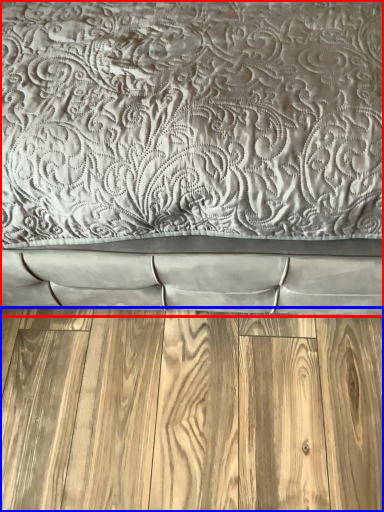
Question: Which of the following is the closest to the observer, bed (highlighted by a red box) or hardwood (highlighted by a blue box)?

Choices:
 (A) bed
 (B) hardwood

Answer: (A)